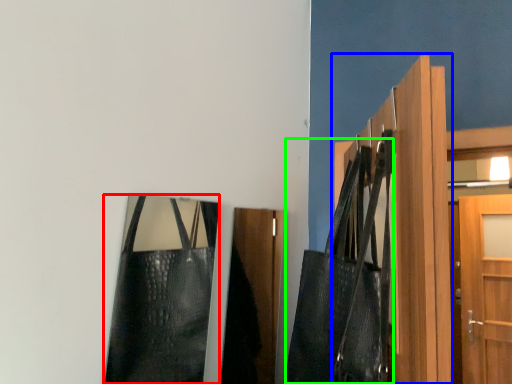
Question: Estimate the real-world distances between objects in this image. Which object is closer to bag (highlighted by a red box), door (highlighted by a blue box) or shoulder bag (highlighted by a green box)?

Choices:
 (A) door
 (B) shoulder bag

Answer: (B)